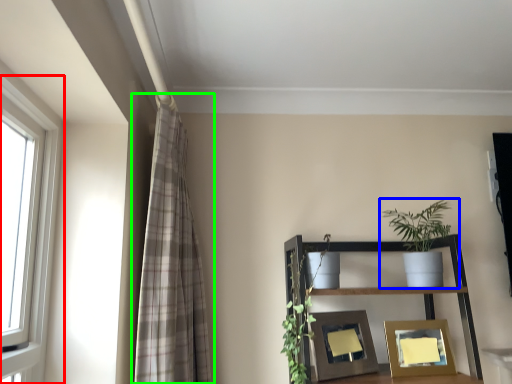
Question: Which is nearer to the window (highlighted by a red box)? houseplant (highlighted by a blue box) or curtain (highlighted by a green box).

Choices:
 (A) houseplant
 (B) curtain

Answer: (B)